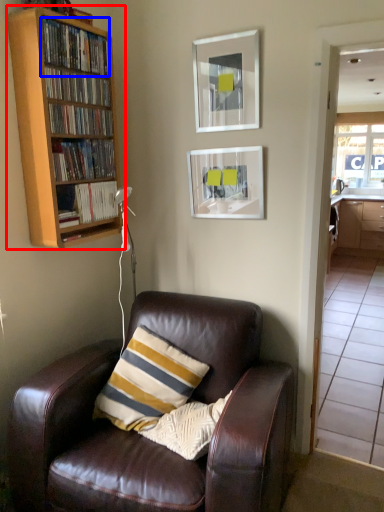
Question: Which of the following is the farthest to the observer, bookcase (highlighted by a red box) or book (highlighted by a blue box)?

Choices:
 (A) bookcase
 (B) book

Answer: (B)